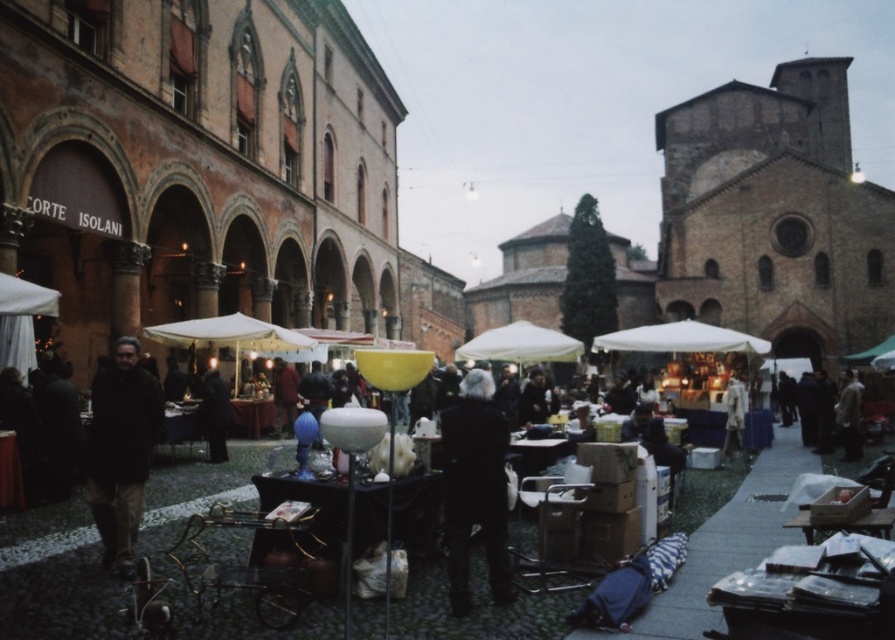
Question: Can you confirm if black wool coat at center is smaller than dark brown leather jacket at left?

Choices:
 (A) yes
 (B) no

Answer: (A)

Question: Which object appears closest to the camera in this image?

Choices:
 (A) black wool coat at center
 (B) dark brown leather jacket at left

Answer: (A)

Question: Does black wool coat at center have a smaller size compared to dark brown leather jacket at left?

Choices:
 (A) no
 (B) yes

Answer: (B)

Question: From the image, what is the correct spatial relationship of black wool coat at center in relation to dark brown leather jacket at left?

Choices:
 (A) above
 (B) below

Answer: (B)

Question: Which of the following is the farthest from the observer?

Choices:
 (A) dark brown leather jacket at left
 (B) black wool coat at center

Answer: (A)